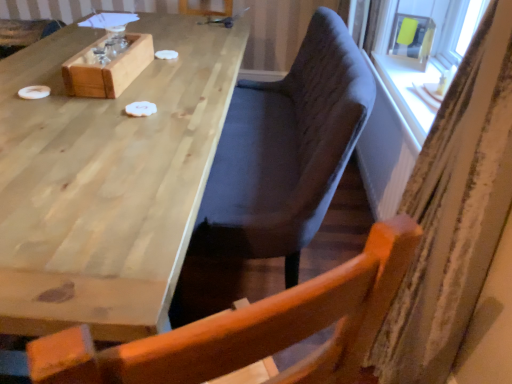
Question: Is natural wood table at upper left oriented towards striped fabric curtain at right?

Choices:
 (A) yes
 (B) no

Answer: (B)

Question: Considering the relative sizes of natural wood table at upper left and striped fabric curtain at right in the image provided, is natural wood table at upper left thinner than striped fabric curtain at right?

Choices:
 (A) no
 (B) yes

Answer: (A)

Question: Considering the relative sizes of natural wood table at upper left and striped fabric curtain at right in the image provided, is natural wood table at upper left wider than striped fabric curtain at right?

Choices:
 (A) yes
 (B) no

Answer: (A)

Question: Considering the relative positions of natural wood table at upper left and striped fabric curtain at right in the image provided, is natural wood table at upper left behind striped fabric curtain at right?

Choices:
 (A) yes
 (B) no

Answer: (A)

Question: Can you confirm if natural wood table at upper left is smaller than striped fabric curtain at right?

Choices:
 (A) no
 (B) yes

Answer: (A)

Question: From the image's perspective, is natural wood table at upper left below striped fabric curtain at right?

Choices:
 (A) no
 (B) yes

Answer: (A)

Question: Does velvet dark blue chair at center appear on the right side of natural wood table at upper left?

Choices:
 (A) yes
 (B) no

Answer: (A)

Question: Is velvet dark blue chair at center directly adjacent to natural wood table at upper left?

Choices:
 (A) no
 (B) yes

Answer: (A)

Question: Considering the relative sizes of velvet dark blue chair at center and natural wood table at upper left in the image provided, is velvet dark blue chair at center smaller than natural wood table at upper left?

Choices:
 (A) yes
 (B) no

Answer: (A)

Question: Is natural wood table at upper left a part of velvet dark blue chair at center?

Choices:
 (A) yes
 (B) no

Answer: (B)

Question: From the image's perspective, is velvet dark blue chair at center located beneath natural wood table at upper left?

Choices:
 (A) yes
 (B) no

Answer: (B)

Question: Is velvet dark blue chair at center completely or partially outside of natural wood table at upper left?

Choices:
 (A) yes
 (B) no

Answer: (A)

Question: Is striped fabric curtain at right positioned with its back to matte yellow plastic at upper right?

Choices:
 (A) yes
 (B) no

Answer: (B)